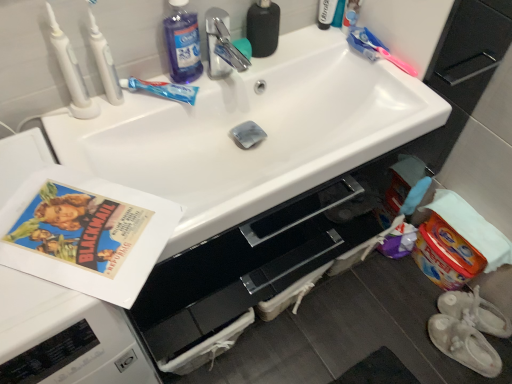
The width and height of the screenshot is (512, 384). I want to click on free spot in front of white plastic toothbrush at upper left, which ranks as the first toothbrush in left-to-right order, so (76, 139).